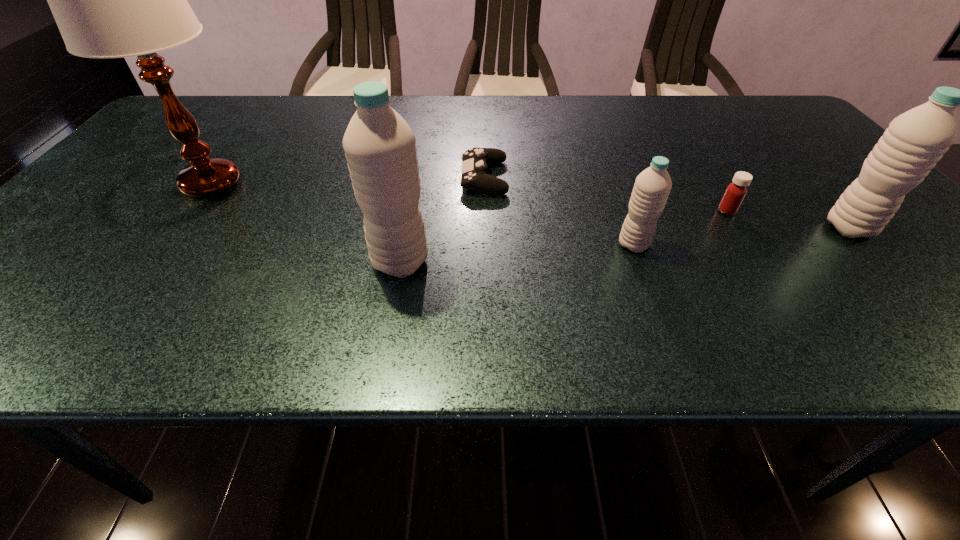
I want to click on empty location between the second shortest water bottle and the third shortest object, so click(x=741, y=237).

At what (x,y) coordinates should I click in order to perform the action: click on free space between the fifth object from left to right and the fifth object from right to left. Please return your answer as a coordinate pair (x, y). Looking at the image, I should click on (564, 237).

Locate an element on the screen. The height and width of the screenshot is (540, 960). vacant region between the tallest object and the control is located at coordinates (348, 181).

Find the location of a particular element. free space between the second water bottle from left to right and the fourth object from right to left is located at coordinates (559, 211).

Locate an element on the screen. Image resolution: width=960 pixels, height=540 pixels. free point between the control and the rightmost object is located at coordinates (666, 203).

The image size is (960, 540). In order to click on free space between the tallest object and the fourth shortest object in this screenshot , I will do `click(530, 206)`.

You are a GUI agent. You are given a task and a screenshot of the screen. Output one action in this format:
    pyautogui.click(x=<x>, y=<y>)
    Task: Click on the vacant area that lies between the third shortest object and the second tallest water bottle
    
    Given the screenshot: What is the action you would take?
    pyautogui.click(x=741, y=237)

I want to click on the closest object to the fifth object from right to left, so click(x=475, y=160).

Identify which object is located as the second nearest to the medicine. Please provide its 2D coordinates. Your answer should be formatted as a tuple, i.e. [(x, y)], where the tuple contains the x and y coordinates of a point satisfying the conditions above.

[(652, 186)]

Locate an element on the screen. The height and width of the screenshot is (540, 960). the second closest water bottle relative to the fifth tallest object is located at coordinates (652, 186).